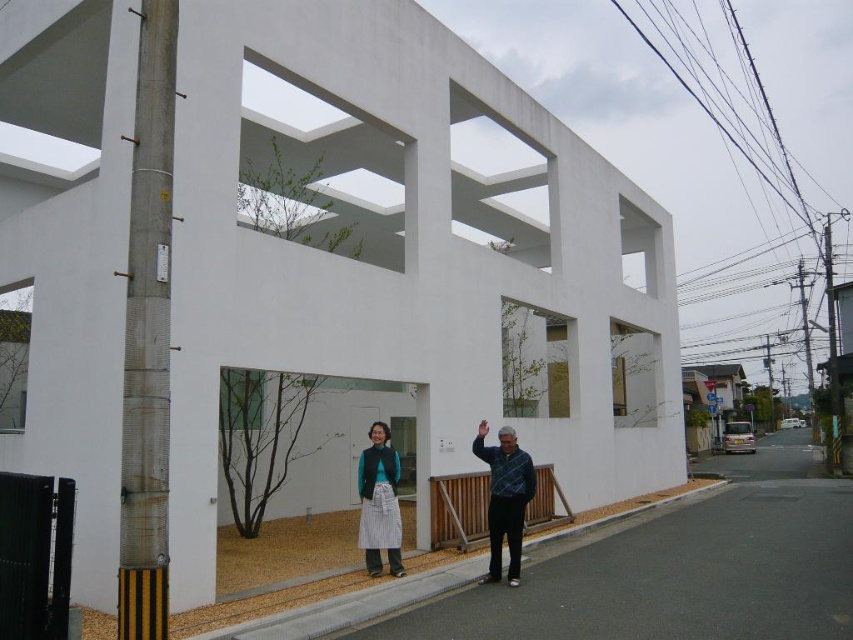
You are a fashion designer observing the two individuals in front of the modern building. You need to determine which clothing item, the blue plaid shirt at lower right or the striped fabric skirt at center, requires more fabric to create. Based on their sizes, which one would you choose?

The blue plaid shirt at lower right is larger in size than the striped fabric skirt at center, so it would require more fabric to create.

You are standing at the entrance of the building and want to greet the person wearing the blue plaid shirt at lower right. In which direction should you walk to reach them?

The blue plaid shirt at lower right is located at point (505, 499), so you should walk towards the lower right direction to reach them.